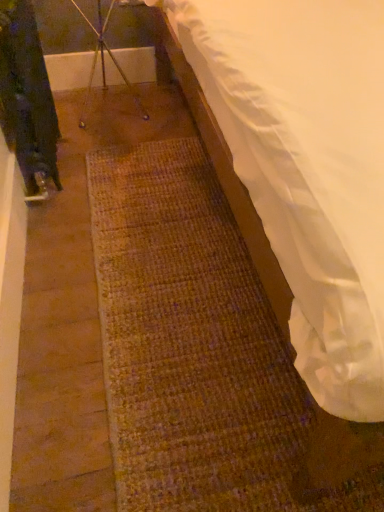
Question: Should I look upward or downward to see metallic tripod at upper center?

Choices:
 (A) up
 (B) down

Answer: (A)

Question: Considering the relative positions of metallic tripod at upper center and white fabric mattress at lower right in the image provided, is metallic tripod at upper center in front of white fabric mattress at lower right?

Choices:
 (A) no
 (B) yes

Answer: (A)

Question: From a real-world perspective, is metallic tripod at upper center physically above white fabric mattress at lower right?

Choices:
 (A) yes
 (B) no

Answer: (B)

Question: Is metallic tripod at upper center turned away from white fabric mattress at lower right?

Choices:
 (A) no
 (B) yes

Answer: (A)

Question: Is metallic tripod at upper center bigger than white fabric mattress at lower right?

Choices:
 (A) no
 (B) yes

Answer: (A)

Question: Is metallic tripod at upper center at the left side of white fabric mattress at lower right?

Choices:
 (A) no
 (B) yes

Answer: (B)

Question: Are metallic tripod at upper center and white fabric mattress at lower right making contact?

Choices:
 (A) yes
 (B) no

Answer: (B)

Question: Is metallic tripod at upper center surrounded by white fabric mattress at lower right?

Choices:
 (A) no
 (B) yes

Answer: (A)

Question: Does white fabric mattress at lower right have a smaller size compared to metallic tripod at upper center?

Choices:
 (A) yes
 (B) no

Answer: (B)

Question: Is white fabric mattress at lower right not near metallic tripod at upper center?

Choices:
 (A) yes
 (B) no

Answer: (A)

Question: Can you confirm if white fabric mattress at lower right is bigger than metallic tripod at upper center?

Choices:
 (A) no
 (B) yes

Answer: (B)

Question: From a real-world perspective, is white fabric mattress at lower right located beneath metallic tripod at upper center?

Choices:
 (A) no
 (B) yes

Answer: (A)

Question: From a real-world perspective, is white fabric mattress at lower right physically above metallic tripod at upper center?

Choices:
 (A) yes
 (B) no

Answer: (A)

Question: Is white fabric mattress at lower right to the left or to the right of metallic tripod at upper center in the image?

Choices:
 (A) right
 (B) left

Answer: (A)